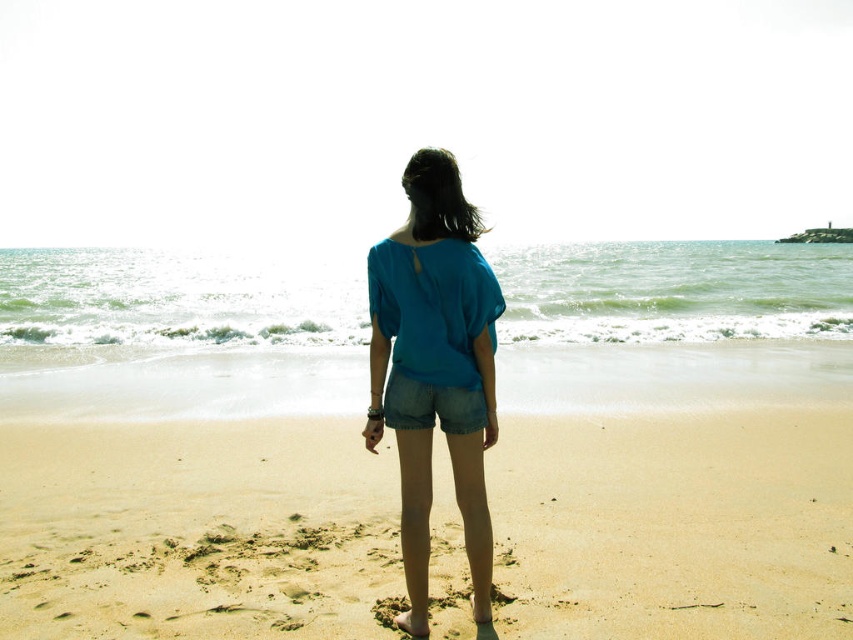
Does smooth sand beach at center have a greater width compared to matte blue blouse at center?

Yes, smooth sand beach at center is wider than matte blue blouse at center.

Does point (289, 420) lie behind point (490, 432)?

That is True.

Find the location of `smooth sand beach at center`. smooth sand beach at center is located at coordinates (675, 492).

Which is behind, point (454, 387) or point (384, 396)?

The point (384, 396) is more distant.

Between matte blue blouse at center and denim shorts at center, which one has more height?

Standing taller between the two is matte blue blouse at center.

Which is behind, point (427, 465) or point (386, 420)?

The point (386, 420) is more distant.

You are a GUI agent. You are given a task and a screenshot of the screen. Output one action in this format:
    pyautogui.click(x=<x>, y=<y>)
    Task: Click on the matte blue blouse at center
    
    Given the screenshot: What is the action you would take?
    pyautogui.click(x=434, y=368)

Can you confirm if smooth sand beach at center is positioned below denim shorts at center?

Yes, smooth sand beach at center is below denim shorts at center.

Does smooth sand beach at center have a smaller size compared to denim shorts at center?

No.

Is point (729, 556) positioned after point (430, 388)?

Yes, point (729, 556) is behind point (430, 388).

At what (x,y) coordinates should I click in order to perform the action: click on smooth sand beach at center. Please return your answer as a coordinate pair (x, y). The image size is (853, 640). Looking at the image, I should click on (675, 492).